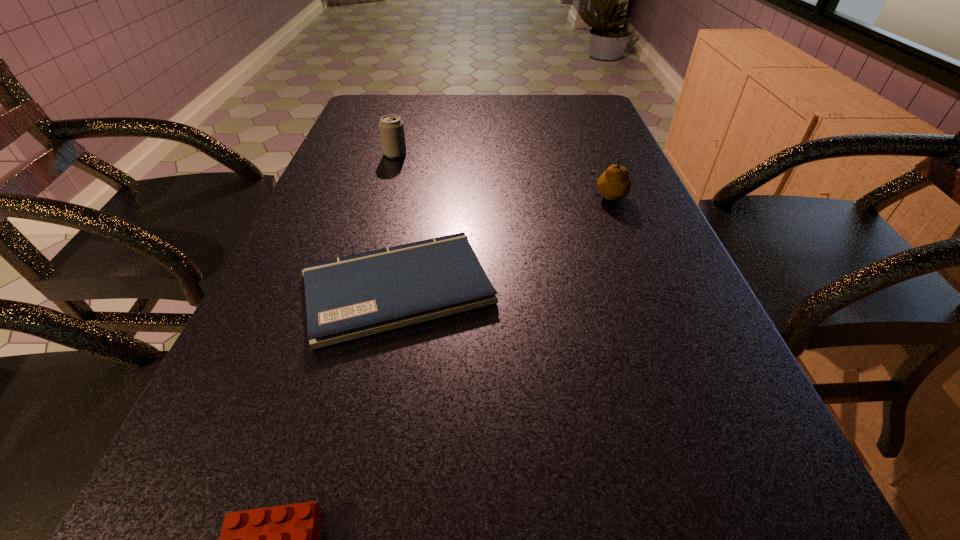
The image size is (960, 540). In order to click on free space between the can and the rightmost object in this screenshot , I will do `click(502, 174)`.

The height and width of the screenshot is (540, 960). What are the coordinates of `free space between the farthest object and the second nearest object` in the screenshot? It's located at (396, 221).

You are a GUI agent. You are given a task and a screenshot of the screen. Output one action in this format:
    pyautogui.click(x=<x>, y=<y>)
    Task: Click on the second closest object to the can
    Image resolution: width=960 pixels, height=540 pixels.
    Given the screenshot: What is the action you would take?
    pyautogui.click(x=614, y=184)

This screenshot has height=540, width=960. What are the coordinates of `the third closest object to the farthest object` in the screenshot? It's located at (285, 539).

You are a GUI agent. You are given a task and a screenshot of the screen. Output one action in this format:
    pyautogui.click(x=<x>, y=<y>)
    Task: Click on the blank space that satisfies the following two spatial constraints: 1. on the front side of the paperback book; 2. on the right side of the can
    The height and width of the screenshot is (540, 960).
    Given the screenshot: What is the action you would take?
    pyautogui.click(x=356, y=288)